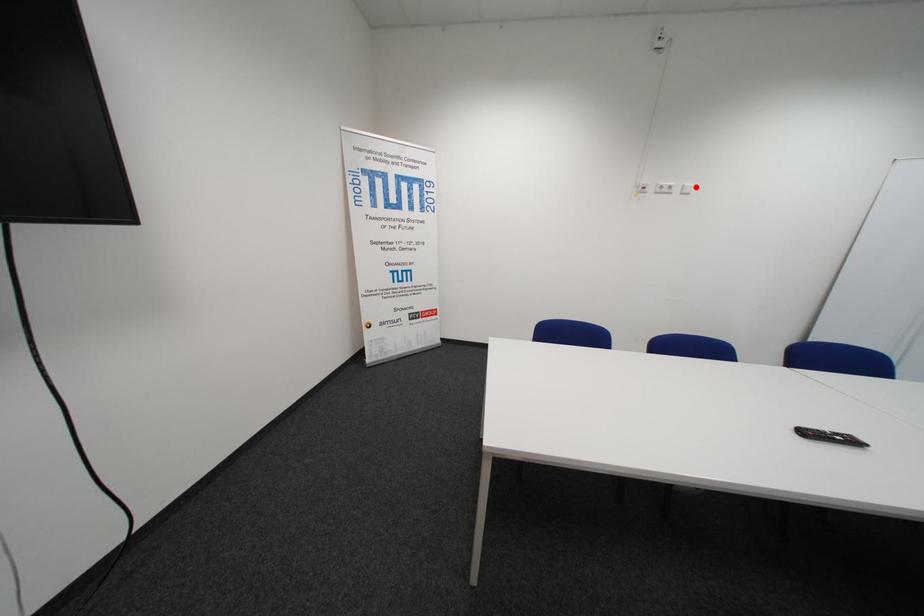
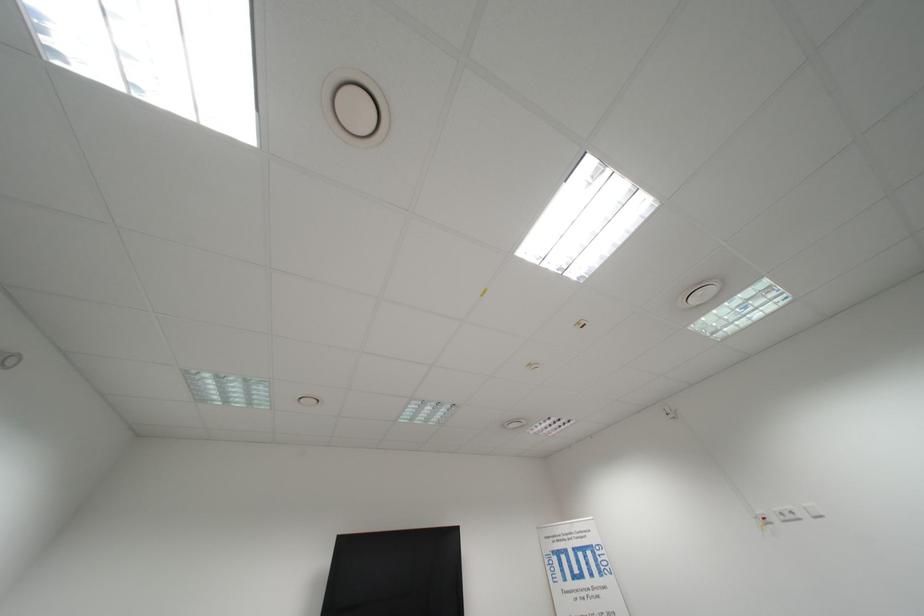
Question: I am providing you with two images of the same scene from different viewpoints. A red point is marked on the first image. Is the red point's position out of view in image 2?

Choices:
 (A) Yes
 (B) No

Answer: (B)